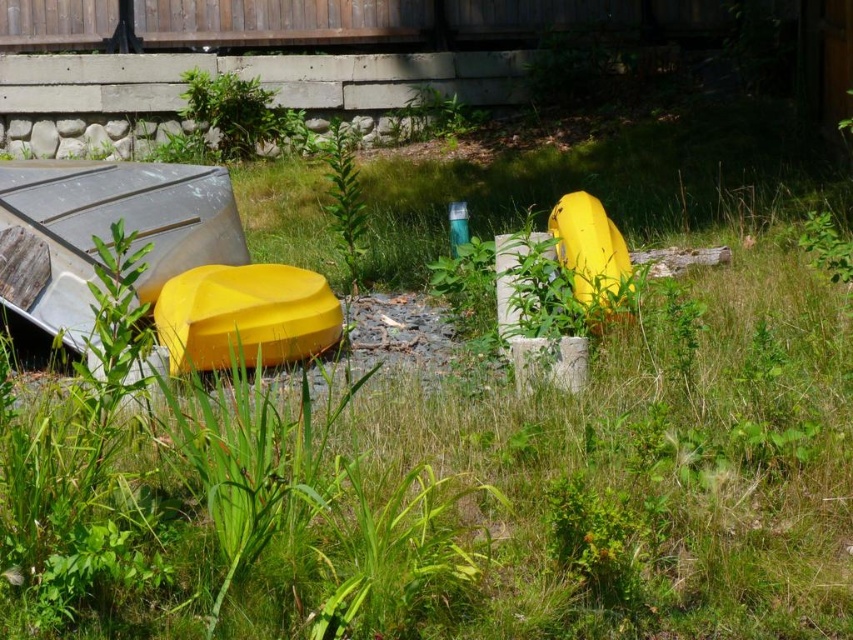
Is matte yellow kayak at left thinner than yellow matte boat at center?

Incorrect, matte yellow kayak at left's width is not less than yellow matte boat at center's.

Can you confirm if matte yellow kayak at left is shorter than yellow matte boat at center?

Incorrect, matte yellow kayak at left's height does not fall short of yellow matte boat at center's.

Locate an element on the screen. The height and width of the screenshot is (640, 853). matte yellow kayak at left is located at coordinates (105, 230).